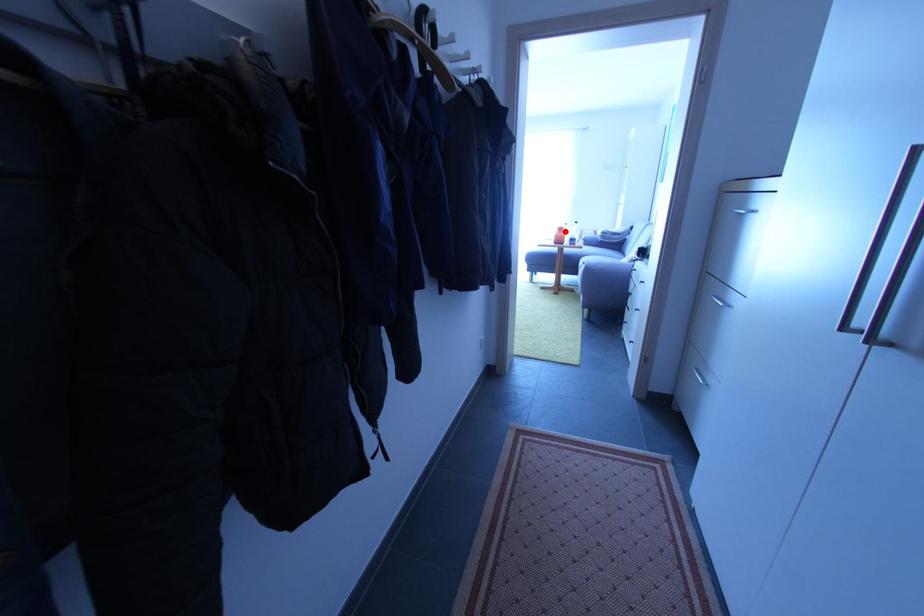
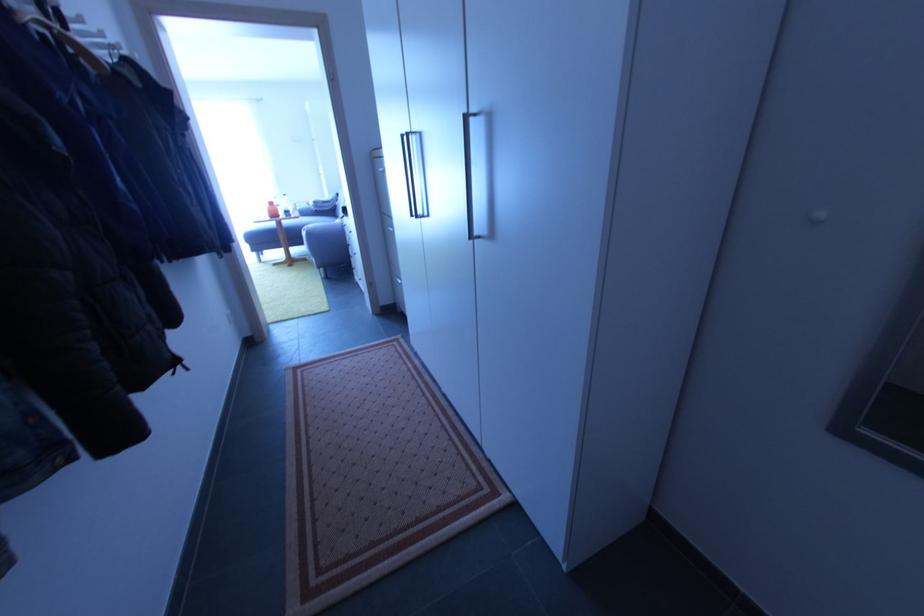
In the second image, find the point that corresponds to the highlighted location in the first image.

(275, 205)